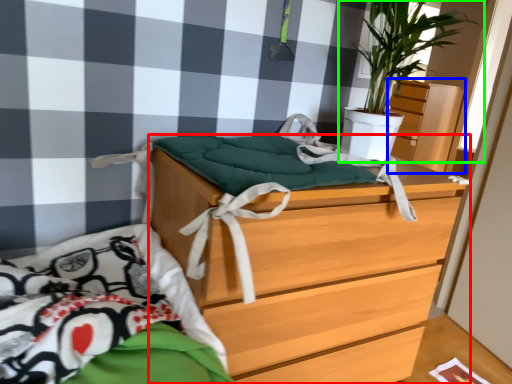
Question: Which object is positioned farthest from chest of drawers (highlighted by a red box)? Select from dresser (highlighted by a blue box) and houseplant (highlighted by a green box).

Choices:
 (A) dresser
 (B) houseplant

Answer: (A)